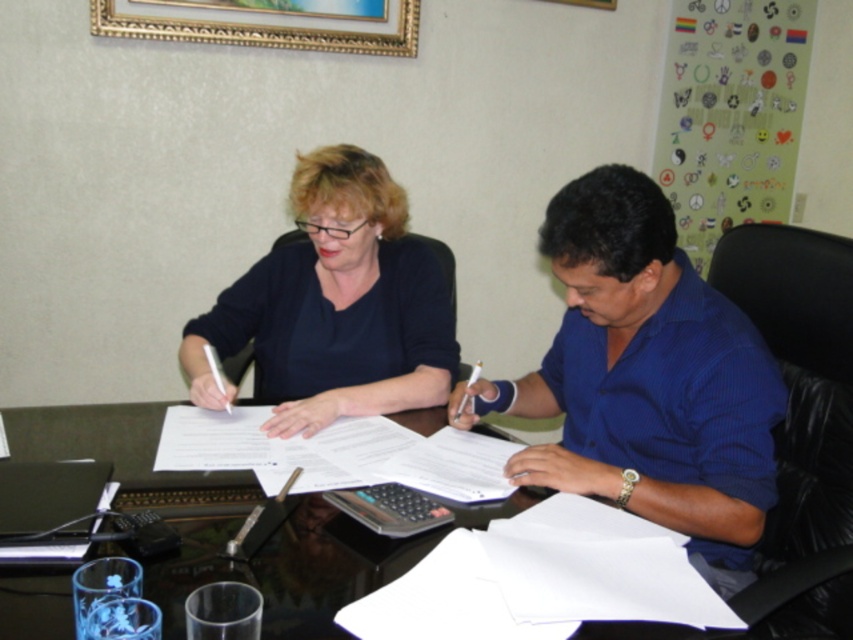
Question: Is white paper at center thinner than gold-framed picture at upper center?

Choices:
 (A) no
 (B) yes

Answer: (B)

Question: Which of the following is the closest to the observer?

Choices:
 (A) blue shirt at center
 (B) white paper at center

Answer: (A)

Question: Can you confirm if matte black shirt at center is positioned below gold-framed picture at upper center?

Choices:
 (A) no
 (B) yes

Answer: (B)

Question: Which of the following is the closest to the observer?

Choices:
 (A) (320, 269)
 (B) (523, 417)
 (C) (135, 36)

Answer: (B)

Question: Can you confirm if matte black shirt at center is positioned to the right of white paper at center?

Choices:
 (A) no
 (B) yes

Answer: (A)

Question: Which object is closer to the camera taking this photo?

Choices:
 (A) white paper at center
 (B) gold-framed picture at upper center
 (C) white paper at lower right

Answer: (C)